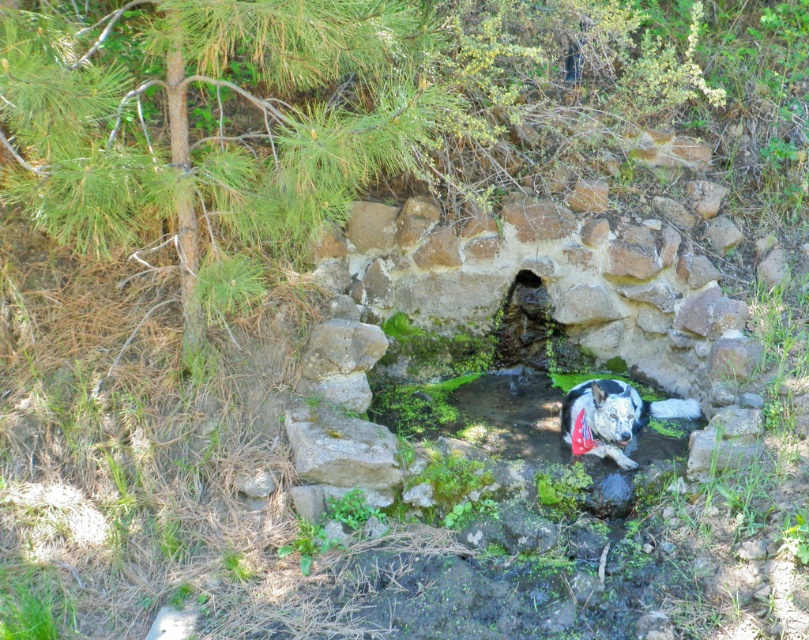
Question: In this image, where is green leafy tree at upper left located relative to green mossy stone at center?

Choices:
 (A) left
 (B) right

Answer: (A)

Question: Does green leafy tree at upper left appear on the left side of green mossy stone at center?

Choices:
 (A) yes
 (B) no

Answer: (A)

Question: Which point is closer to the camera?

Choices:
 (A) green mossy stone at center
 (B) green leafy tree at upper left

Answer: (B)

Question: Can you confirm if green leafy tree at upper left is smaller than green mossy stone at center?

Choices:
 (A) yes
 (B) no

Answer: (B)

Question: Which object appears farthest from the camera in this image?

Choices:
 (A) green mossy stone at center
 (B) green leafy tree at upper left

Answer: (A)

Question: Which of the following is the farthest from the observer?

Choices:
 (A) (51, 45)
 (B) (544, 369)

Answer: (B)